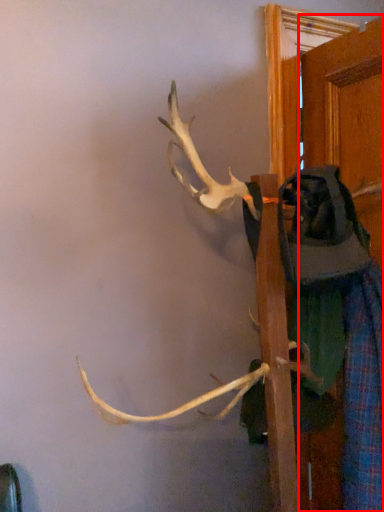
Question: Where is door (annotated by the red box) located in relation to clothing in the image?

Choices:
 (A) left
 (B) right

Answer: (B)